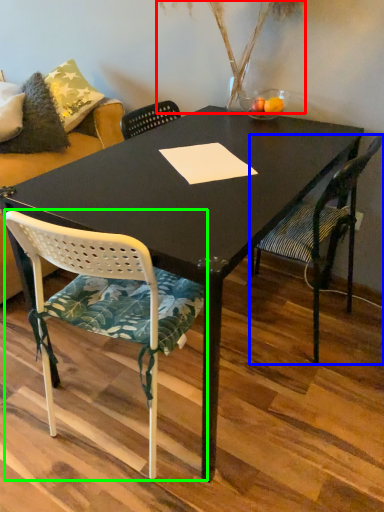
Question: Which object is the closest to the plant (highlighted by a red box)? Choose among these: chair (highlighted by a blue box) or chair (highlighted by a green box).

Choices:
 (A) chair
 (B) chair

Answer: (A)